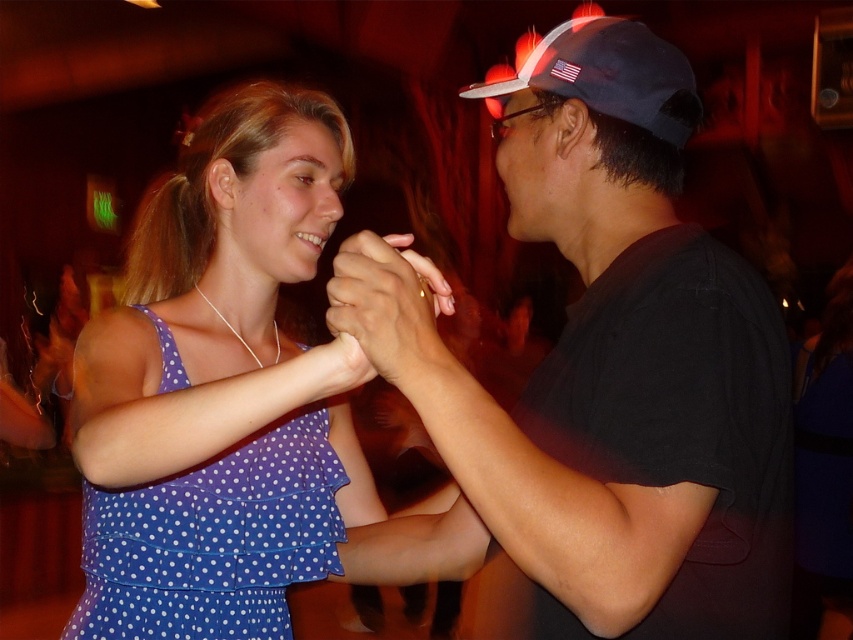
Based on the photo, is blue polka dot dress at center above blue fabric baseball cap at upper right?

Incorrect, blue polka dot dress at center is not positioned above blue fabric baseball cap at upper right.

Is point (248, 636) positioned after point (618, 45)?

Yes, point (248, 636) is behind point (618, 45).

Is point (316, 483) more distant than point (489, 93)?

Yes.

Find the location of `blue polka dot dress at center`. blue polka dot dress at center is located at coordinates (219, 387).

Which of these two, blue polka dot fabric dress at center or matte skin at center, stands shorter?

matte skin at center is shorter.

Which is above, blue polka dot fabric dress at center or matte skin at center?

matte skin at center is above.

At what (x,y) coordinates should I click in order to perform the action: click on blue polka dot fabric dress at center. Please return your answer as a coordinate pair (x, y). Looking at the image, I should click on (213, 540).

Does black matte shirt at center have a lesser height compared to blue fabric baseball cap at upper right?

No.

Between black matte shirt at center and blue fabric baseball cap at upper right, which one has less height?

blue fabric baseball cap at upper right is shorter.

Image resolution: width=853 pixels, height=640 pixels. What do you see at coordinates (598, 380) in the screenshot? I see `black matte shirt at center` at bounding box center [598, 380].

Locate an element on the screen. The image size is (853, 640). black matte shirt at center is located at coordinates (598, 380).